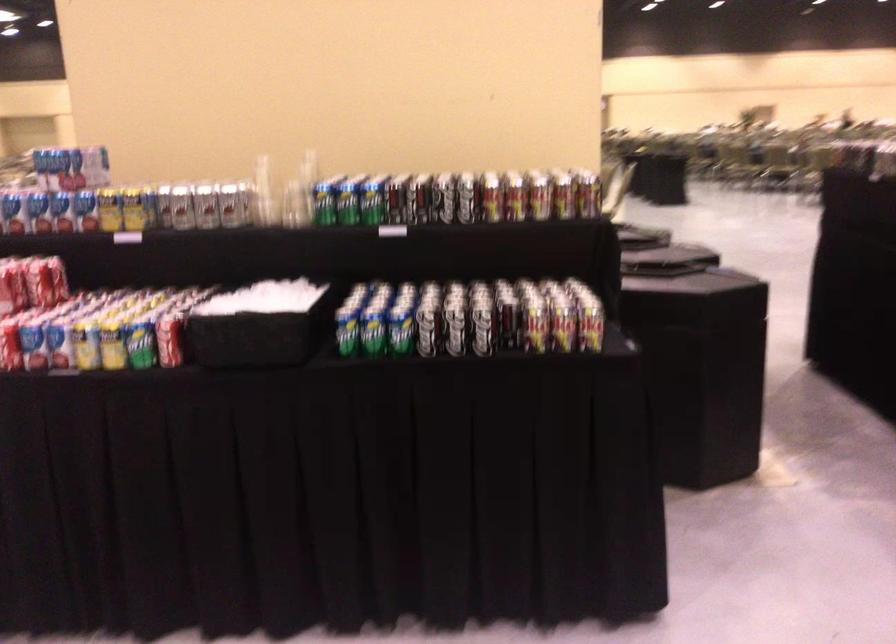
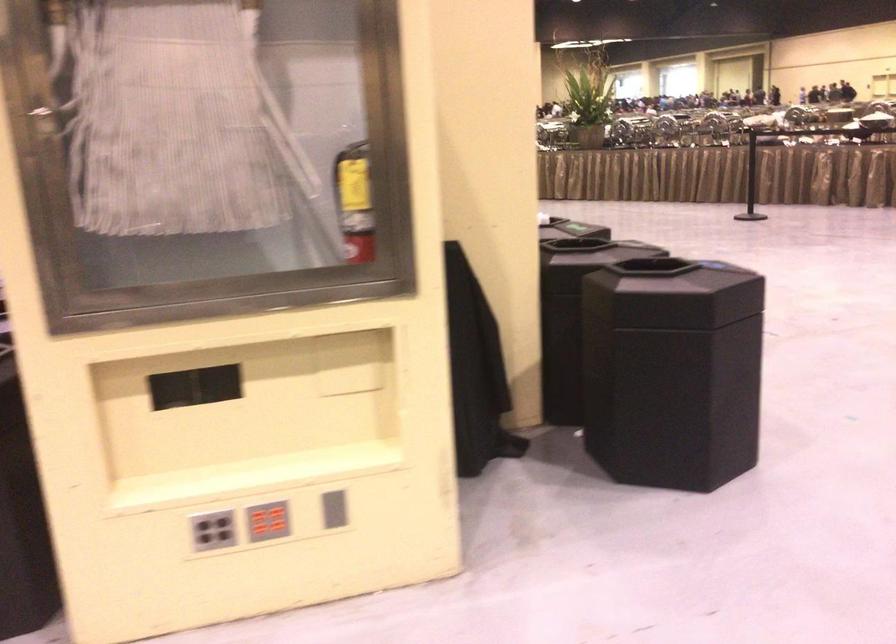
Question: I am providing you with two images of the same scene from different viewpoints. Which of the following objects are not visible in image2?

Choices:
 (A) white plush toy
 (B) grey vertical slot
 (C) red button panel
 (D) red soda can

Answer: (D)